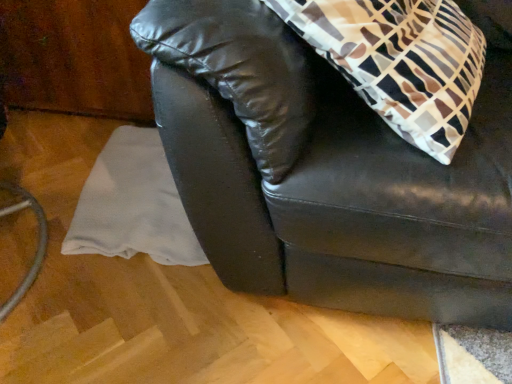
What are the coordinates of `black leather couch at upper right` in the screenshot? It's located at (328, 172).

Describe the element at coordinates (328, 172) in the screenshot. I see `black leather couch at upper right` at that location.

Locate an element on the screen. black leather couch at upper right is located at coordinates (328, 172).